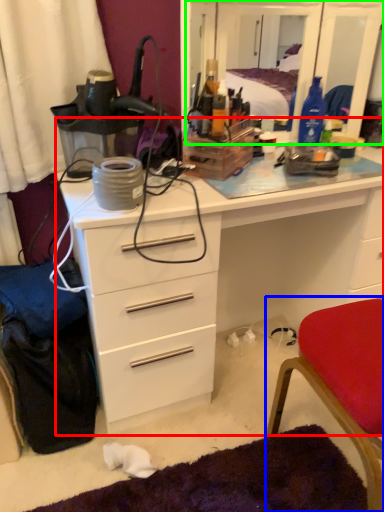
Question: Estimate the real-world distances between objects in this image. Which object is farther from chest of drawers (highlighted by a red box), chair (highlighted by a blue box) or mirror (highlighted by a green box)?

Choices:
 (A) chair
 (B) mirror

Answer: (B)